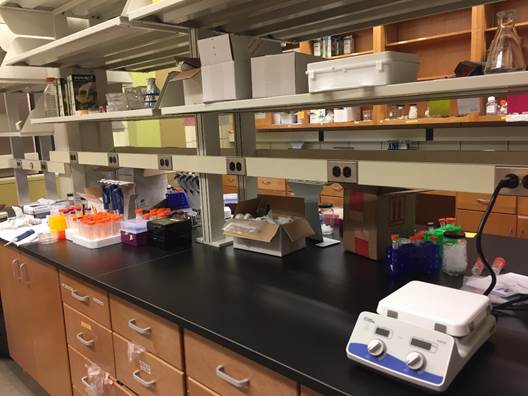
Identify the location of floor. Image resolution: width=528 pixels, height=396 pixels. tap(8, 384).